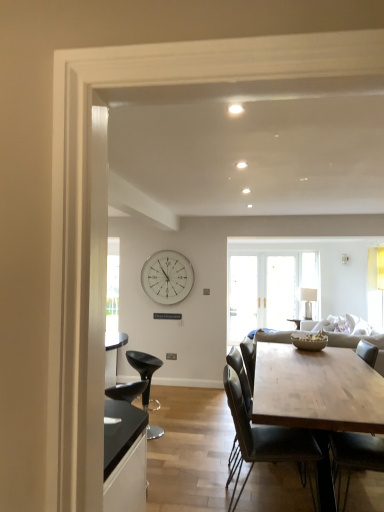
Question: Is white glossy clock at upper center facing towards light gray fabric couch at center?

Choices:
 (A) no
 (B) yes

Answer: (A)

Question: Is white glossy clock at upper center closer to camera compared to light gray fabric couch at center?

Choices:
 (A) no
 (B) yes

Answer: (A)

Question: From the image's perspective, is white glossy clock at upper center below light gray fabric couch at center?

Choices:
 (A) yes
 (B) no

Answer: (B)

Question: Is white glossy clock at upper center bigger than light gray fabric couch at center?

Choices:
 (A) no
 (B) yes

Answer: (A)

Question: Considering the relative sizes of white glossy clock at upper center and light gray fabric couch at center in the image provided, is white glossy clock at upper center shorter than light gray fabric couch at center?

Choices:
 (A) yes
 (B) no

Answer: (A)

Question: Is white glossy clock at upper center surrounding light gray fabric couch at center?

Choices:
 (A) no
 (B) yes

Answer: (A)

Question: Considering the relative sizes of natural wood table at center and dark gray leather chair at center, which ranks as the 2th chair in back-to-front order, in the image provided, is natural wood table at center thinner than dark gray leather chair at center, which ranks as the 2th chair in back-to-front order,?

Choices:
 (A) no
 (B) yes

Answer: (A)

Question: Is natural wood table at center bigger than dark gray leather chair at center, the second chair viewed from the right?

Choices:
 (A) no
 (B) yes

Answer: (B)

Question: Is the depth of natural wood table at center greater than that of dark gray leather chair at center, the 2th chair from the left?

Choices:
 (A) yes
 (B) no

Answer: (B)

Question: From the image's perspective, is natural wood table at center below dark gray leather chair at center, which ranks as the 2th chair in back-to-front order?

Choices:
 (A) yes
 (B) no

Answer: (A)

Question: From the image's perspective, is natural wood table at center above dark gray leather chair at center, which ranks as the 2th chair in back-to-front order?

Choices:
 (A) yes
 (B) no

Answer: (B)

Question: From a real-world perspective, is natural wood table at center located higher than dark gray leather chair at center, the second chair viewed from the right?

Choices:
 (A) yes
 (B) no

Answer: (B)

Question: From the image's perspective, would you say natural wood table at center is positioned over white glossy clock at upper center?

Choices:
 (A) yes
 (B) no

Answer: (B)